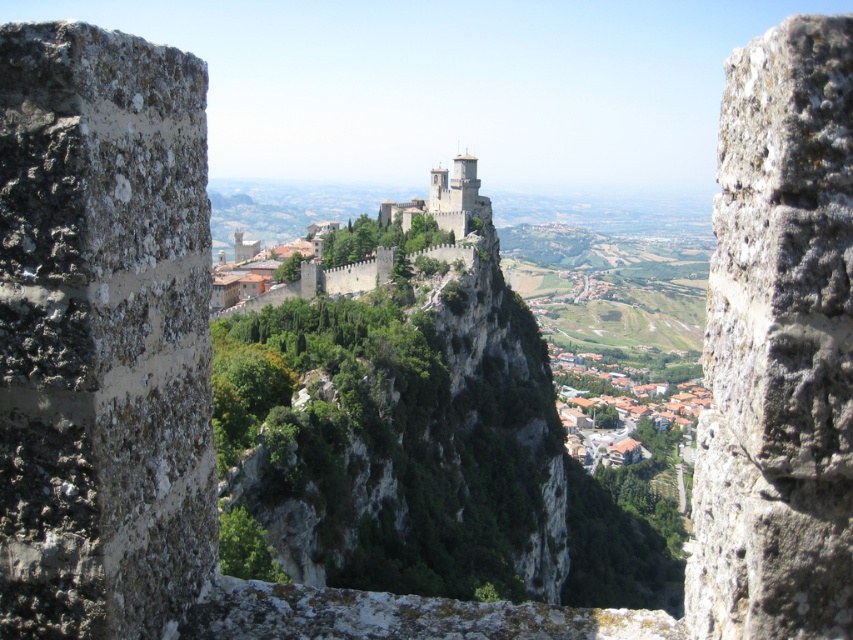
You are an architect designing a new defensive structure. You have to decide whether to use the rough stone wall at center or the stone medieval castle at center as a reference for width. Which one is narrower and thus more suitable for a narrow passageway?

The rough stone wall at center has a lesser width compared to the stone medieval castle at center, making it more suitable for a narrow passageway.

You are a medieval knight standing on the rough stone wall at center. You want to reach the stone medieval castle at center to deliver a message. Which direction should you move to reach it?

The rough stone wall at center is located below the stone medieval castle at center, so you should move upward to reach it.